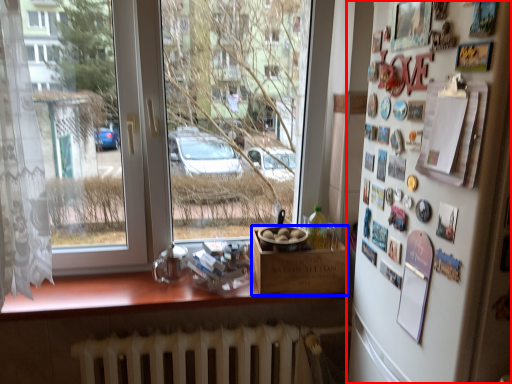
Question: Which object is further to the camera taking this photo, mirror (highlighted by a red box) or box (highlighted by a blue box)?

Choices:
 (A) mirror
 (B) box

Answer: (B)